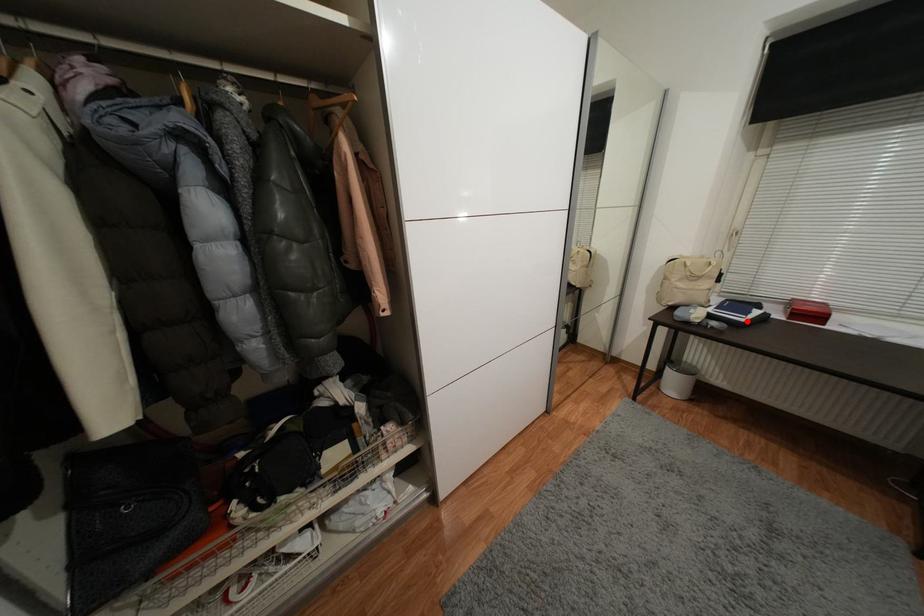
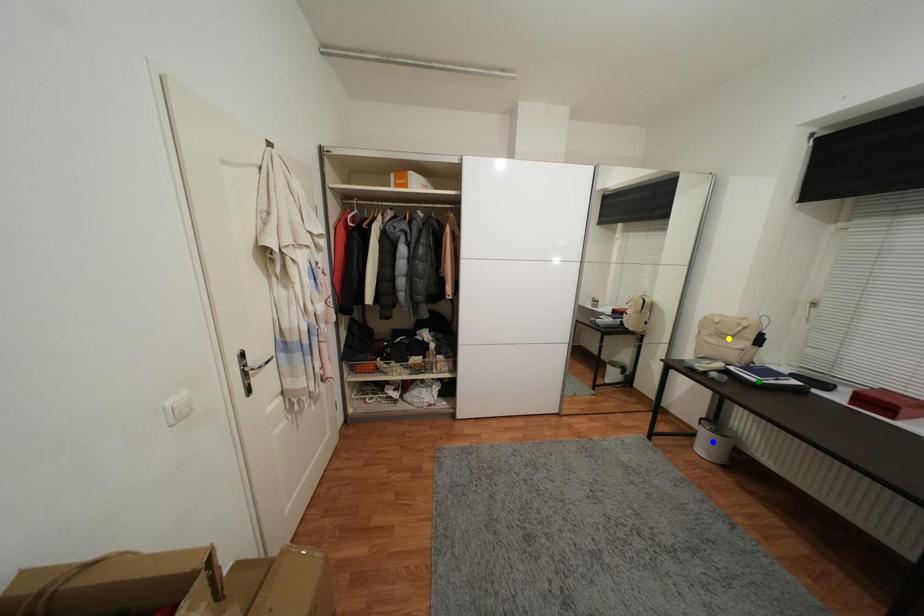
Question: I am providing you with two images of the same scene from different viewpoints. A red point is marked on the first image. You are given multiple points on the second image. Can you choose the point in image 2 that corresponds to the point in image 1?

Choices:
 (A) yellow point
 (B) blue point
 (C) green point

Answer: (C)